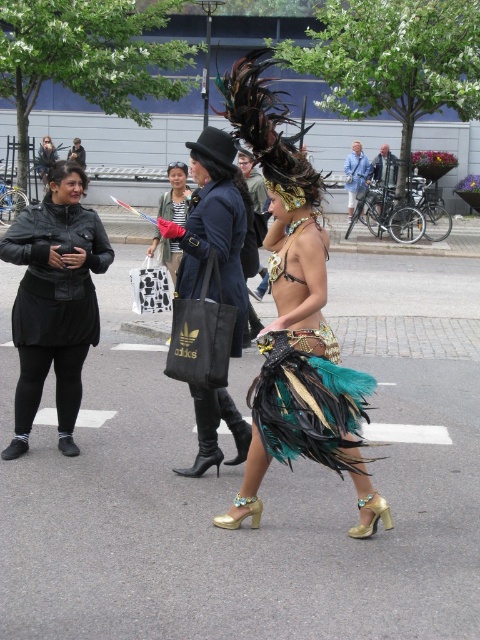
Question: Is feathered costume at center further to the viewer compared to black lace bikini top at center?

Choices:
 (A) no
 (B) yes

Answer: (A)

Question: Does gold shiny sandal at lower center appear on the left side of metallic silver bicycle at center?

Choices:
 (A) yes
 (B) no

Answer: (A)

Question: Which point is closer to the camera taking this photo?

Choices:
 (A) (381, 147)
 (B) (200, 452)

Answer: (B)

Question: Which point appears farthest from the camera in this image?

Choices:
 (A) (324, 244)
 (B) (340, 392)
 (C) (360, 531)
 (D) (356, 164)

Answer: (D)

Question: Does blue denim jacket at center have a smaller size compared to gold metallic high-heeled shoe at center?

Choices:
 (A) yes
 (B) no

Answer: (B)

Question: Which point is farther to the camera?

Choices:
 (A) (x=228, y=218)
 (B) (x=354, y=536)
 (C) (x=299, y=188)
 (D) (x=21, y=336)

Answer: (D)